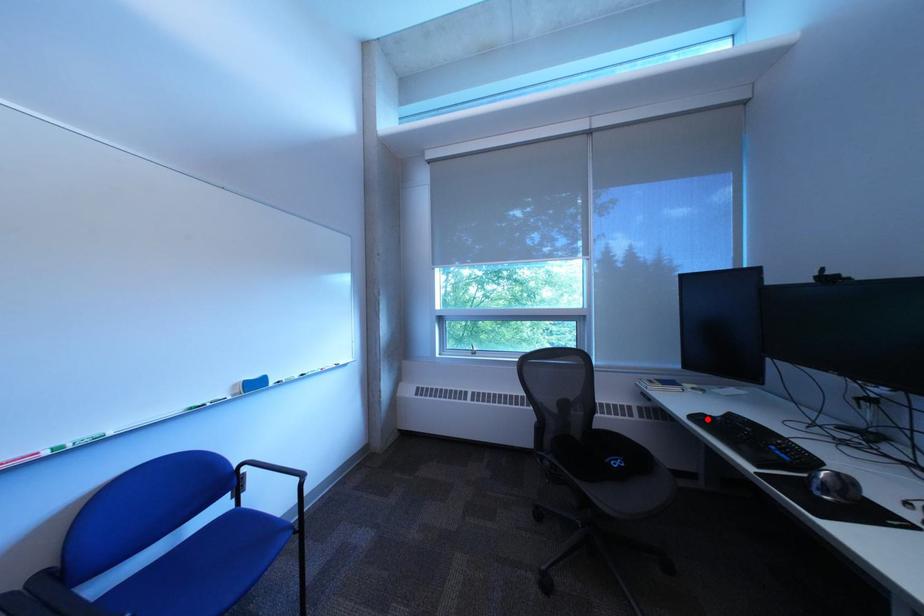
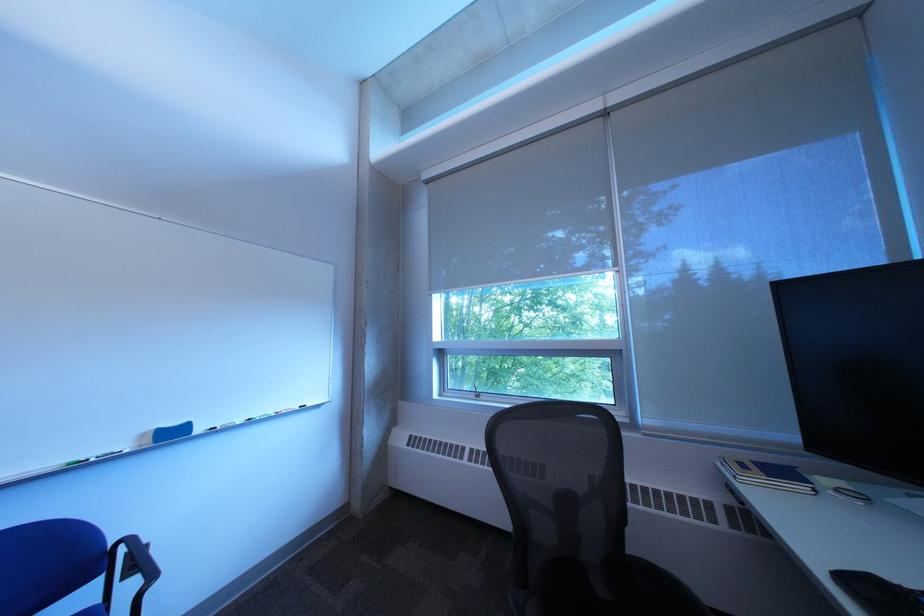
In the second image, find the point that corresponds to the highlighted location in the first image.

(860, 582)